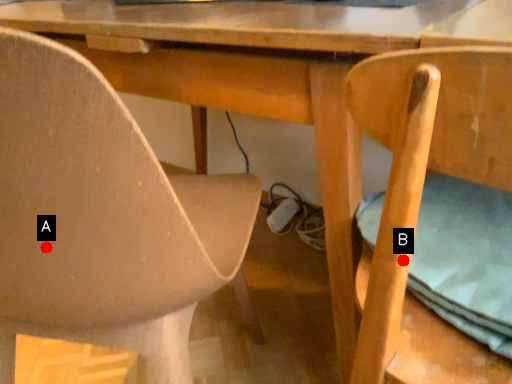
Question: Two points are circled on the image, labeled by A and B beside each circle. Which point is farther to the camera?

Choices:
 (A) A is further
 (B) B is further

Answer: (A)